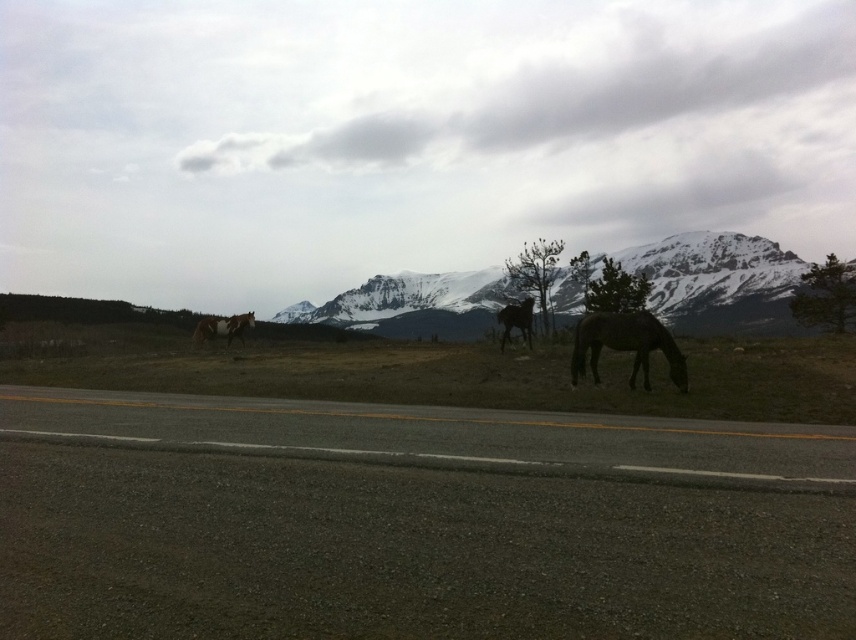
You are standing at the point marked as point (444, 436) in the image. What surface are you standing on?

The point (444, 436) is on the gray asphalt highway at lower center, so you are standing on the gray asphalt highway at lower center.

You are a driver approaching the gray asphalt highway at lower center and see the brown glossy horse at left nearby. Can you determine which object appears larger in the image?

The brown glossy horse at left appears larger than the gray asphalt highway at lower center in the image.